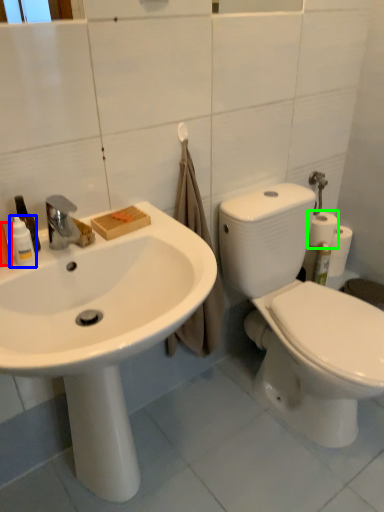
Question: Based on their relative distances, which object is farther from cleaning product (highlighted by a red box)? Choose from toiletry (highlighted by a blue box) and toilet paper (highlighted by a green box).

Choices:
 (A) toiletry
 (B) toilet paper

Answer: (B)